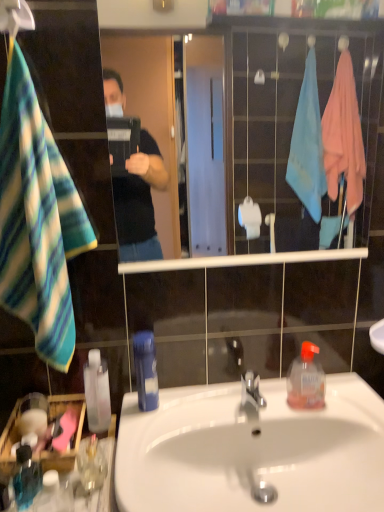
Question: Can you confirm if white glossy sink at center is bigger than striped fleece towel at left?

Choices:
 (A) yes
 (B) no

Answer: (A)

Question: Is white glossy sink at center taller than striped fleece towel at left?

Choices:
 (A) yes
 (B) no

Answer: (B)

Question: Does white glossy sink at center contain striped fleece towel at left?

Choices:
 (A) yes
 (B) no

Answer: (B)

Question: From a real-world perspective, is white glossy sink at center over striped fleece towel at left?

Choices:
 (A) yes
 (B) no

Answer: (B)

Question: Are white glossy sink at center and striped fleece towel at left beside each other?

Choices:
 (A) yes
 (B) no

Answer: (B)

Question: From the image's perspective, is white glossy sink at center below striped fleece towel at left?

Choices:
 (A) no
 (B) yes

Answer: (B)

Question: Is white glossy sink at center touching transparent plastic bottle at lower left, which is the 3th bottle from left to right?

Choices:
 (A) no
 (B) yes

Answer: (A)

Question: Is white glossy sink at center positioned with its back to transparent plastic bottle at lower left, the third bottle viewed from the right?

Choices:
 (A) yes
 (B) no

Answer: (B)

Question: Is transparent plastic bottle at lower left, which is the 3th bottle from left to right, completely or partially inside white glossy sink at center?

Choices:
 (A) yes
 (B) no

Answer: (B)

Question: From a real-world perspective, is white glossy sink at center on top of transparent plastic bottle at lower left, the third bottle viewed from the right?

Choices:
 (A) yes
 (B) no

Answer: (B)

Question: Is white glossy sink at center aimed at transparent plastic bottle at lower left, the third bottle viewed from the right?

Choices:
 (A) no
 (B) yes

Answer: (A)

Question: Is white glossy sink at center positioned behind transparent plastic bottle at lower left, which is the 3th bottle from left to right?

Choices:
 (A) yes
 (B) no

Answer: (B)

Question: Is translucent glass mug at lower left shorter than blue plastic bottle at sink, arranged as the fourth bottle when viewed from the left?

Choices:
 (A) no
 (B) yes

Answer: (B)